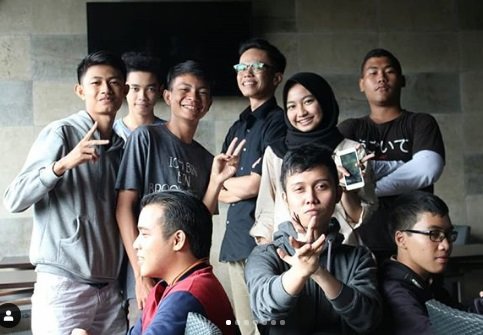
Find the location of a particular element. Image resolution: width=483 pixels, height=335 pixels. phone is located at coordinates (355, 173).